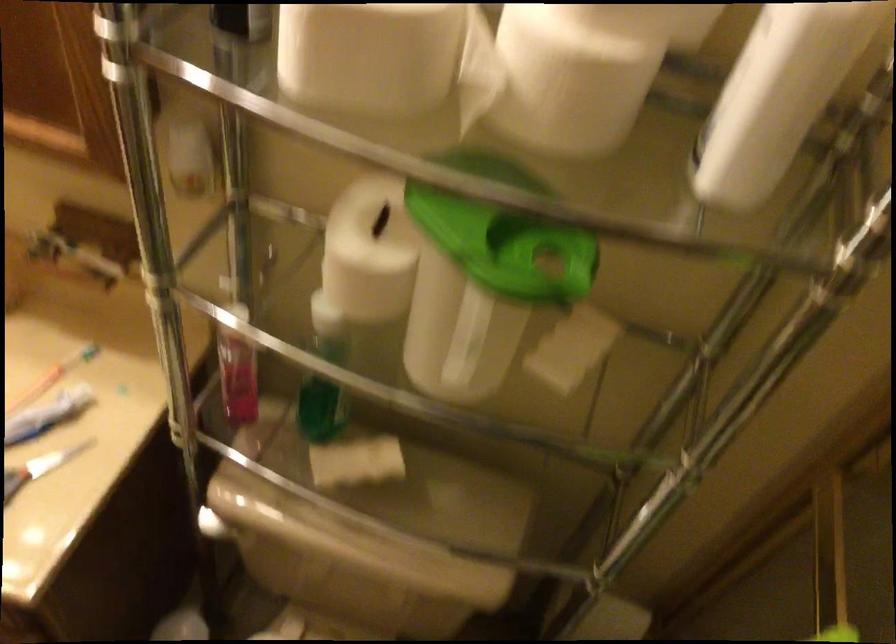
Find the location of a particular element. The width and height of the screenshot is (896, 644). green container lid is located at coordinates (506, 247).